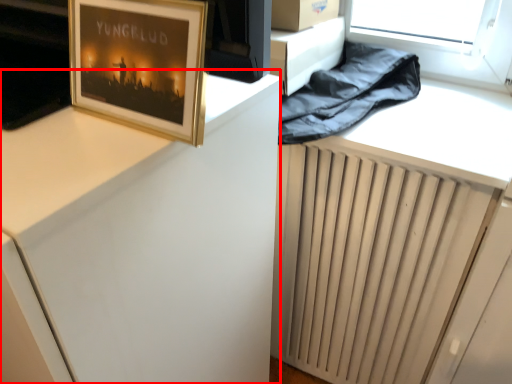
Question: Observing the image, what is the correct spatial positioning of computer desk (annotated by the red box) in reference to picture frame?

Choices:
 (A) right
 (B) left

Answer: (B)